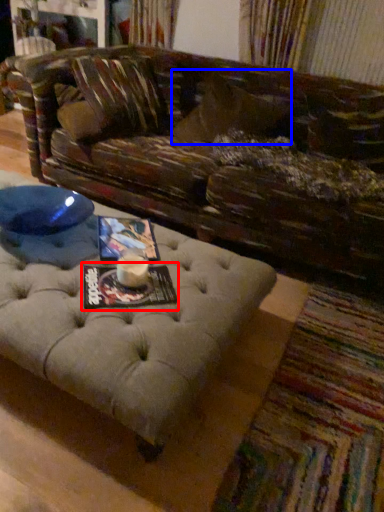
Question: Which object appears closest to the camera in this image, magazine (highlighted by a red box) or pillow (highlighted by a blue box)?

Choices:
 (A) magazine
 (B) pillow

Answer: (A)